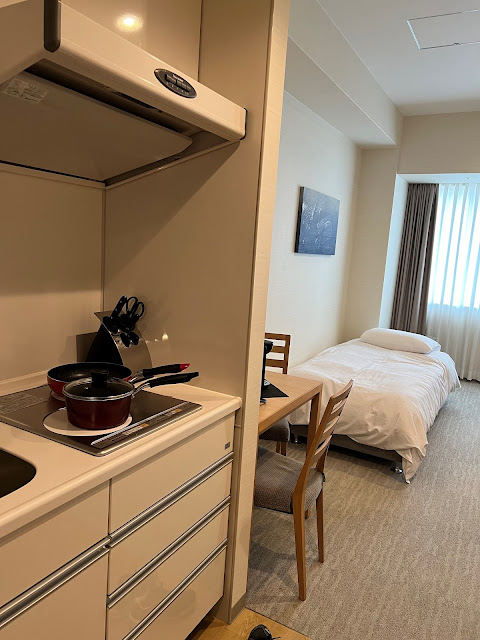
Image resolution: width=480 pixels, height=640 pixels. I want to click on sink edge, so (22, 474).